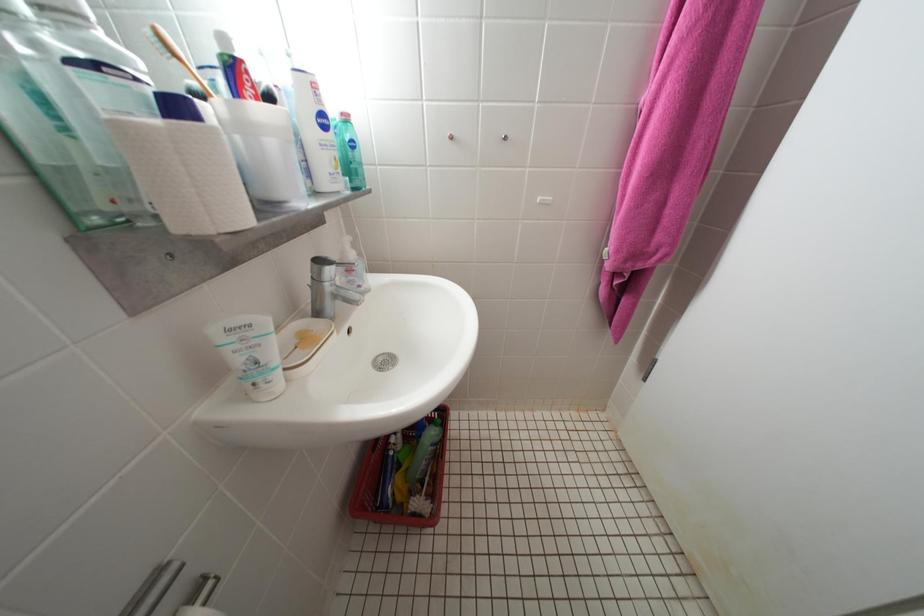
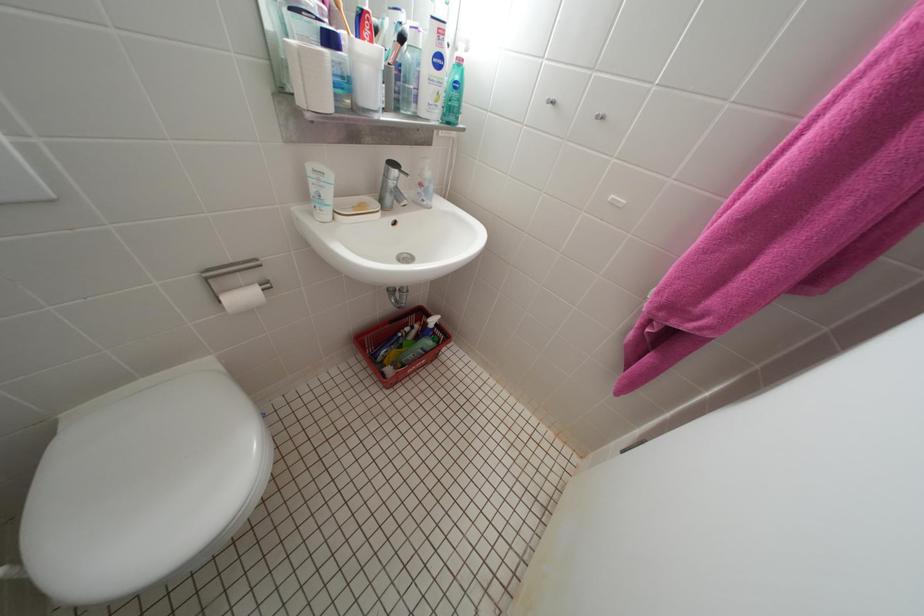
Question: The camera is either moving clockwise (left) or counter-clockwise (right) around the object. The first image is from the beginning of the video and the second image is from the end. Is the camera moving left or right when shooting the video?

Choices:
 (A) Left
 (B) Right

Answer: (B)